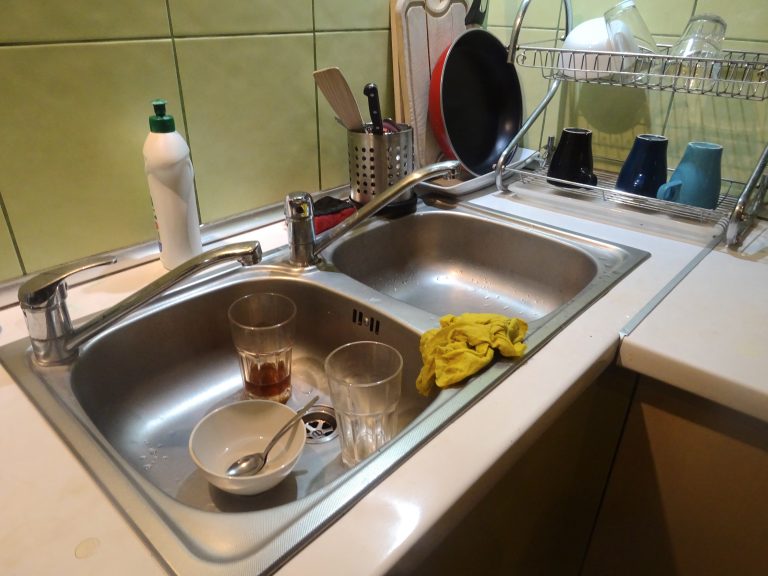
Identify the location of glass. pos(378,404), pos(247,337), pos(703,31), pos(634,34).